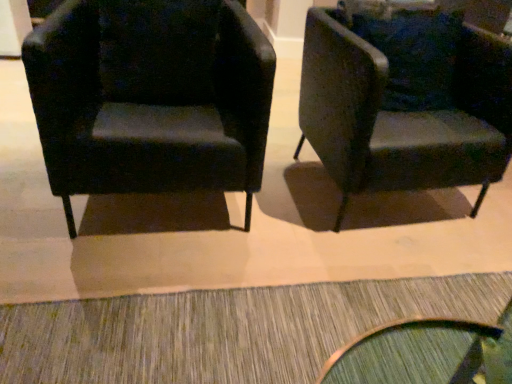
Question: Does textured gray doormat at lower center have a greater height compared to matte black armchair at left, the 2th chair viewed from the right?

Choices:
 (A) yes
 (B) no

Answer: (B)

Question: Is matte black armchair at left, the 2th chair viewed from the right, at the back of textured gray doormat at lower center?

Choices:
 (A) no
 (B) yes

Answer: (A)

Question: From a real-world perspective, is textured gray doormat at lower center on top of matte black armchair at left, the 2th chair viewed from the right?

Choices:
 (A) yes
 (B) no

Answer: (B)

Question: Is textured gray doormat at lower center smaller than matte black armchair at left, acting as the first chair starting from the left?

Choices:
 (A) no
 (B) yes

Answer: (B)

Question: Is textured gray doormat at lower center further to the viewer compared to matte black armchair at left, acting as the first chair starting from the left?

Choices:
 (A) yes
 (B) no

Answer: (B)

Question: From a real-world perspective, is textured gray doormat at lower center below matte black armchair at left, acting as the first chair starting from the left?

Choices:
 (A) yes
 (B) no

Answer: (A)

Question: Can you see matte black armchair at left, the 2th chair viewed from the right, touching textured gray doormat at lower center?

Choices:
 (A) yes
 (B) no

Answer: (B)

Question: Is matte black armchair at left, the 2th chair viewed from the right, wider than textured gray doormat at lower center?

Choices:
 (A) yes
 (B) no

Answer: (A)

Question: Can you confirm if matte black armchair at left, the 2th chair viewed from the right, is shorter than textured gray doormat at lower center?

Choices:
 (A) yes
 (B) no

Answer: (B)

Question: Considering the relative sizes of matte black armchair at left, acting as the first chair starting from the left, and textured gray doormat at lower center in the image provided, is matte black armchair at left, acting as the first chair starting from the left, thinner than textured gray doormat at lower center?

Choices:
 (A) no
 (B) yes

Answer: (A)

Question: Is matte black armchair at left, the 2th chair viewed from the right, to the left of textured gray doormat at lower center from the viewer's perspective?

Choices:
 (A) yes
 (B) no

Answer: (A)

Question: Is matte black armchair at left, acting as the first chair starting from the left, taller than textured gray doormat at lower center?

Choices:
 (A) yes
 (B) no

Answer: (A)

Question: Is matte black armchair at left, the 2th chair viewed from the right, completely or partially inside velvet dark green armchair at right, the first chair when ordered from right to left?

Choices:
 (A) no
 (B) yes

Answer: (A)